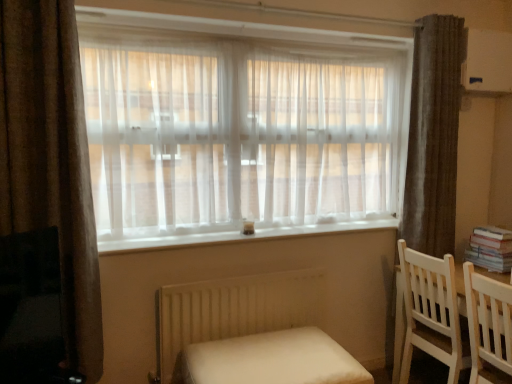
Question: From the image's perspective, relative to white wooden chair at right, the 1th chair in the front-to-back sequence, is brown velvet curtain at left, which appears as the second curtain when viewed from the right, above or below?

Choices:
 (A) above
 (B) below

Answer: (A)

Question: Considering the positions of brown velvet curtain at left, the first curtain from the left, and white wooden chair at right, the 1th chair in the front-to-back sequence, in the image, is brown velvet curtain at left, the first curtain from the left, wider or thinner than white wooden chair at right, the 1th chair in the front-to-back sequence,?

Choices:
 (A) thin
 (B) wide

Answer: (A)

Question: Based on their relative distances, which object is nearer to the brown textured curtain at right, the 1th curtain when ordered from right to left?

Choices:
 (A) white matte radiator at lower center
 (B) white smooth window sill at center
 (C) brown velvet curtain at left, which is the second curtain in back-to-front order
 (D) white paper book at right
 (E) white fabric bed at lower center

Answer: (D)

Question: Which is farther from the white paper book at right?

Choices:
 (A) white wooden chair at right, which is the 2th chair in back-to-front order
 (B) brown textured curtain at right, placed as the first curtain when sorted from back to front
 (C) white matte radiator at lower center
 (D) white wood chair at lower right, which ranks as the 2th chair in front-to-back order
 (E) white fabric bed at lower center

Answer: (C)